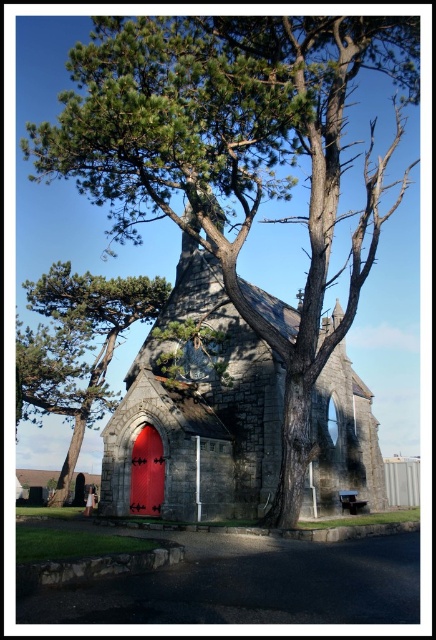
You are a visitor standing at the entrance of the stone chapel at center. You want to take a photo of the green textured pine tree at upper left without any obstructions. Considering the distance between them, can you fit the entire tree in your camera frame if your camera has a 50mm lens and a field of view of 46 degrees?

The green textured pine tree at upper left is 58.81 feet from the stone chapel at center. With a 50mm lens and a 46 degree field of view, the camera can capture objects up to approximately 58 feet away within its frame. Therefore, the entire tree can be captured without obstructions.

You are a painter standing in front of the church and want to paint both the green textured pine tree at center and the shiny red door at center. Which object should you focus on first if you want to paint the larger one first?

The green textured pine tree at center is larger in size than the shiny red door at center, so you should focus on painting the green textured pine tree at center first.

You are standing in front of the stone chapel at center and the green textured pine tree at center. Which object is nearer to you?

The stone chapel at center is closer to the viewer than the green textured pine tree at center.